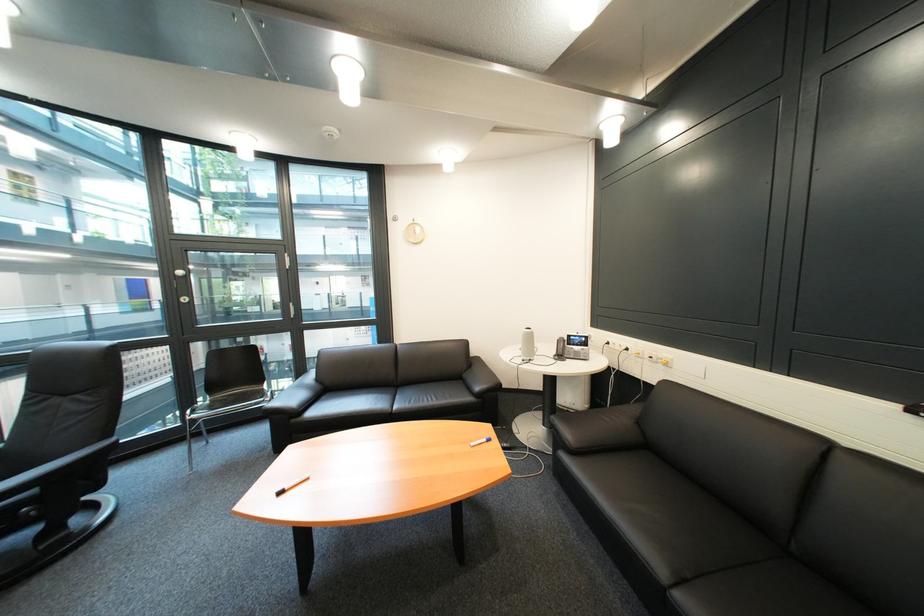
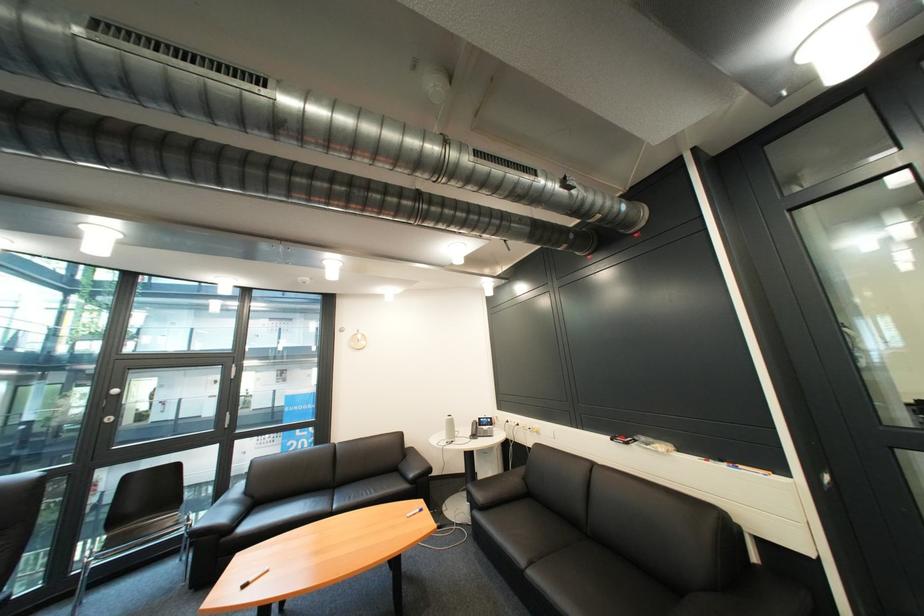
Where in the second image is the point corresponding to (582,338) from the first image?

(492, 419)